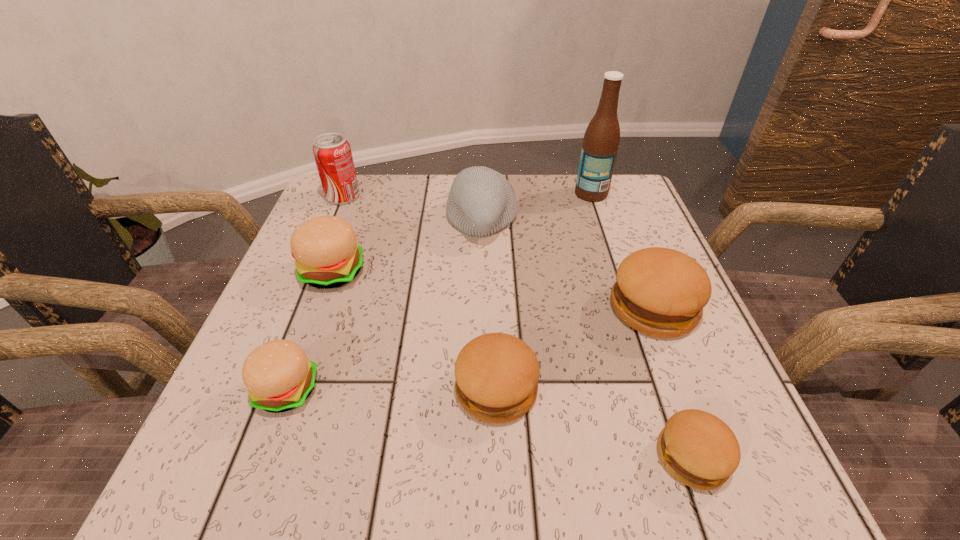
Where is `soda can situated at the far edge`? The image size is (960, 540). soda can situated at the far edge is located at coordinates (332, 152).

Where is `beanie at the far edge`? The image size is (960, 540). beanie at the far edge is located at coordinates (481, 201).

Find the location of a particular element. The width and height of the screenshot is (960, 540). object that is positioned at the near edge is located at coordinates (697, 448).

Find the location of `soda can present at the left edge`. soda can present at the left edge is located at coordinates (332, 152).

Where is `beer bottle that is positioned at the right edge`? The height and width of the screenshot is (540, 960). beer bottle that is positioned at the right edge is located at coordinates (601, 140).

Find the location of a particular element. The image size is (960, 540). object that is positioned at the far left corner is located at coordinates (332, 152).

The image size is (960, 540). I want to click on object that is at the far right corner, so click(601, 140).

The image size is (960, 540). Find the location of `object that is at the near right corner`. object that is at the near right corner is located at coordinates (697, 448).

Locate an element on the screen. The width and height of the screenshot is (960, 540). free location at the far edge of the desktop is located at coordinates (554, 184).

Find the location of a particular element. vacant region at the near edge is located at coordinates (540, 462).